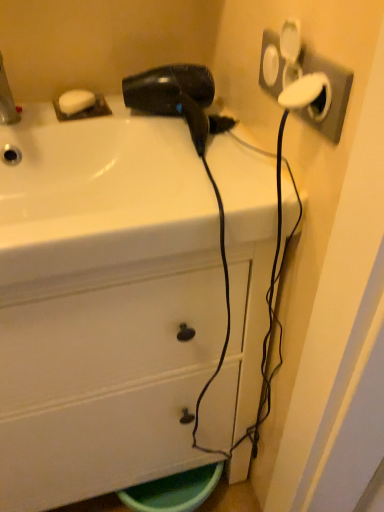
Question: Could you tell me if white glossy sink at upper center is facing white glossy cabinet at center?

Choices:
 (A) no
 (B) yes

Answer: (B)

Question: Considering the relative sizes of white glossy sink at upper center and white glossy cabinet at center in the image provided, is white glossy sink at upper center shorter than white glossy cabinet at center?

Choices:
 (A) no
 (B) yes

Answer: (B)

Question: Is white glossy sink at upper center next to white glossy cabinet at center?

Choices:
 (A) no
 (B) yes

Answer: (A)

Question: Considering the relative sizes of white glossy sink at upper center and white glossy cabinet at center in the image provided, is white glossy sink at upper center wider than white glossy cabinet at center?

Choices:
 (A) yes
 (B) no

Answer: (B)

Question: Does white glossy sink at upper center have a larger size compared to white glossy cabinet at center?

Choices:
 (A) yes
 (B) no

Answer: (B)

Question: From the image's perspective, is white glossy sink at upper center located beneath white glossy cabinet at center?

Choices:
 (A) no
 (B) yes

Answer: (A)

Question: Is black matte hair dryer at upper center further to camera compared to white glossy sink at upper center?

Choices:
 (A) yes
 (B) no

Answer: (A)

Question: Does black matte hair dryer at upper center have a lesser height compared to white glossy sink at upper center?

Choices:
 (A) no
 (B) yes

Answer: (B)

Question: From a real-world perspective, is black matte hair dryer at upper center physically below white glossy sink at upper center?

Choices:
 (A) no
 (B) yes

Answer: (A)

Question: Is black matte hair dryer at upper center closer to the viewer compared to white glossy sink at upper center?

Choices:
 (A) no
 (B) yes

Answer: (A)

Question: Would you say black matte hair dryer at upper center is outside white glossy sink at upper center?

Choices:
 (A) yes
 (B) no

Answer: (A)

Question: From the image's perspective, would you say black matte hair dryer at upper center is shown under white glossy sink at upper center?

Choices:
 (A) yes
 (B) no

Answer: (B)

Question: Can you confirm if white plastic socket at upper right is shorter than white matte soap at upper left?

Choices:
 (A) yes
 (B) no

Answer: (B)